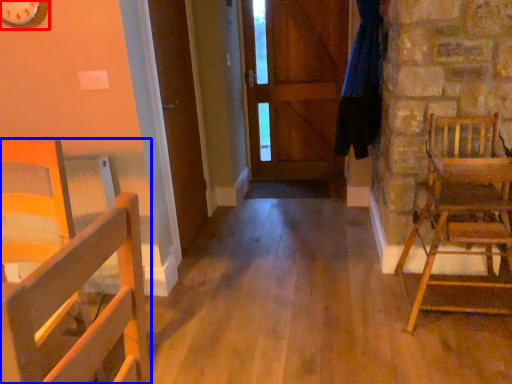
Question: Which object appears farthest to the camera in this image, clock (highlighted by a red box) or chair (highlighted by a blue box)?

Choices:
 (A) clock
 (B) chair

Answer: (B)